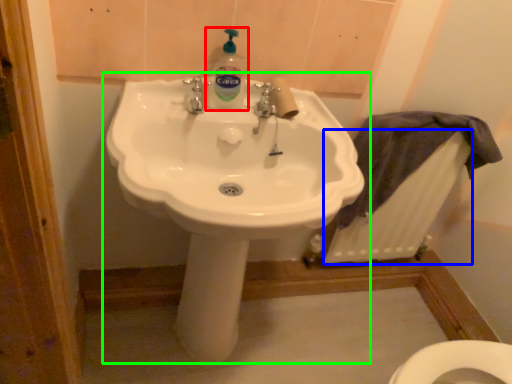
Question: Which is nearer to the cleaning product (highlighted by a red box)? radiator (highlighted by a blue box) or sink (highlighted by a green box).

Choices:
 (A) radiator
 (B) sink

Answer: (B)